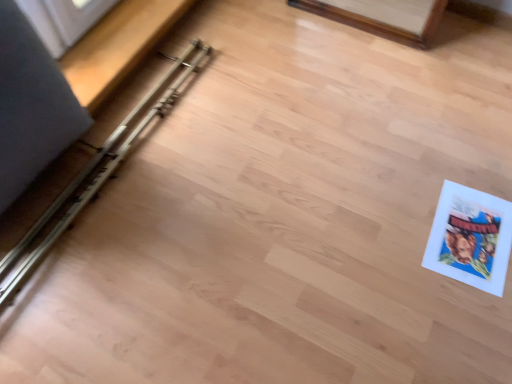
Locate an element on the screen. The image size is (512, 384). free space in front of white paper comic book at lower right is located at coordinates (464, 312).